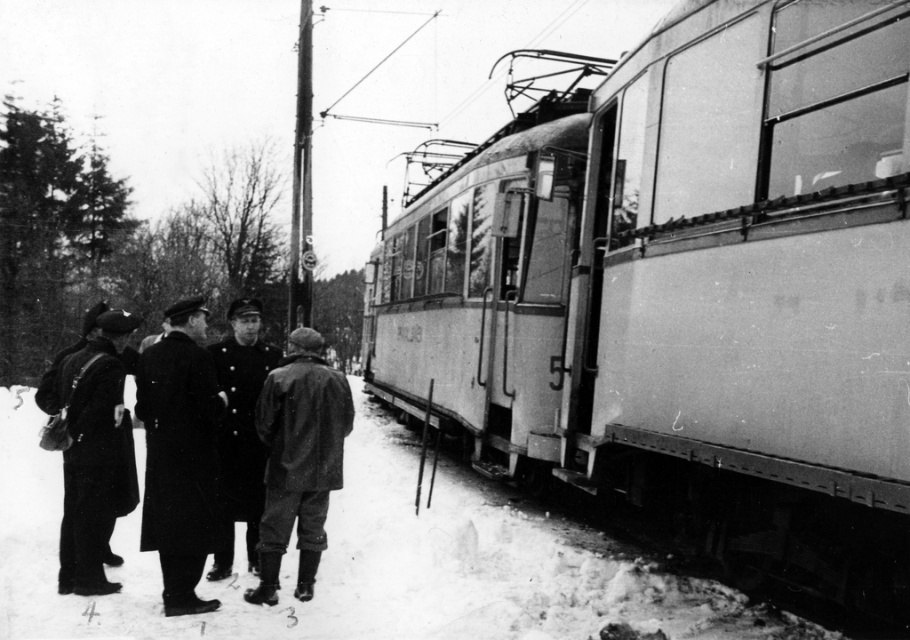
Question: Which object appears farthest from the camera in this image?

Choices:
 (A) dark brown leather jacket at center
 (B) smooth metal train at right
 (C) uniformed man at center

Answer: (C)

Question: Is smooth metal train at right to the right of uniformed man at center from the viewer's perspective?

Choices:
 (A) yes
 (B) no

Answer: (A)

Question: In this image, where is smooth metal train at right located relative to dark brown leather jacket at center?

Choices:
 (A) above
 (B) below

Answer: (A)

Question: Estimate the real-world distances between objects in this image. Which object is closer to the dark wool coat at center?

Choices:
 (A) matte black coat at left
 (B) dark brown leather jacket at center

Answer: (A)

Question: Which point is farther to the camera?

Choices:
 (A) (100, 493)
 (B) (188, 563)
 (C) (295, 360)

Answer: (C)

Question: Can you confirm if dark wool coat at center is wider than dark brown leather jacket at center?

Choices:
 (A) no
 (B) yes

Answer: (A)